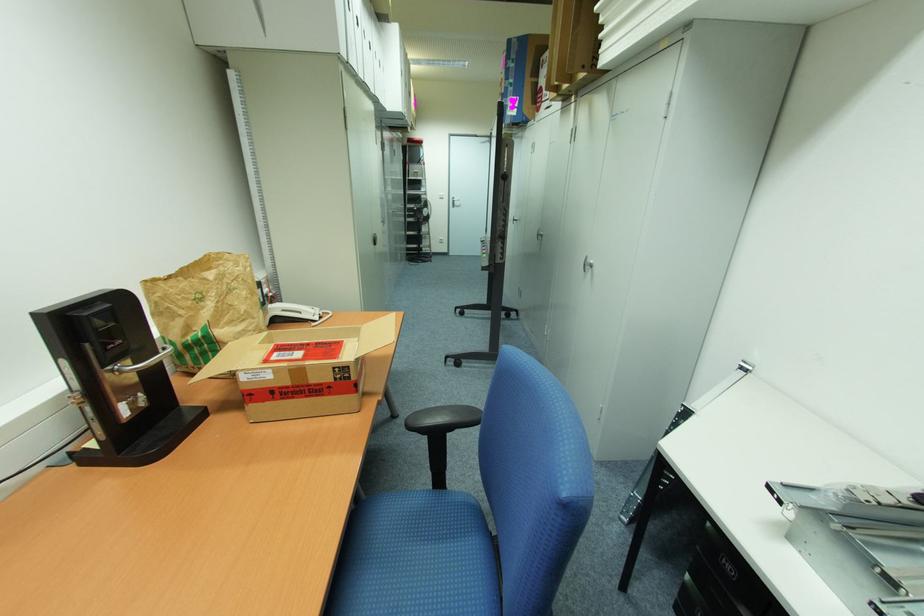
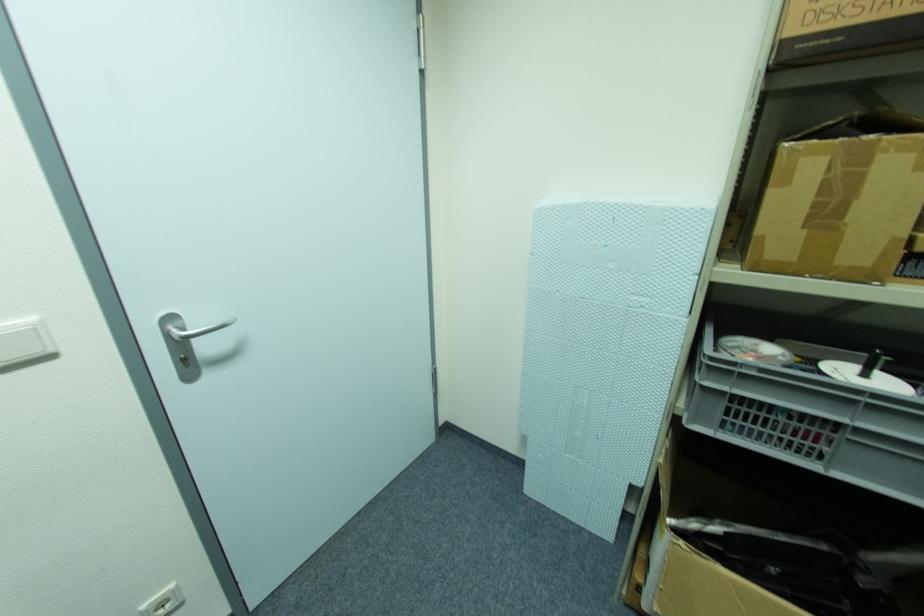
The point at (444,196) is marked in the first image. Where is the corresponding point in the second image?

(34, 331)